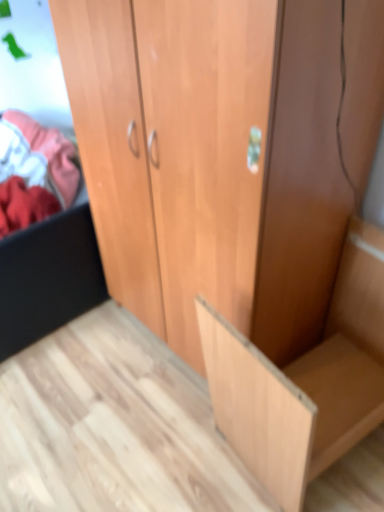
Describe the element at coordinates (305, 379) in the screenshot. This screenshot has height=512, width=384. I see `light wood cabinet at lower right` at that location.

Identify the location of light wood cabinet at lower right. The image size is (384, 512). (305, 379).

Where is `light wood cabinet at lower right`? light wood cabinet at lower right is located at coordinates (305, 379).